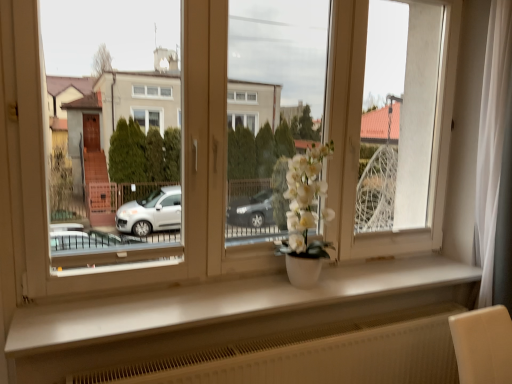
Where is `free region under white matte flower pot at center (from a real-world perspective)`? The height and width of the screenshot is (384, 512). free region under white matte flower pot at center (from a real-world perspective) is located at coordinates (228, 284).